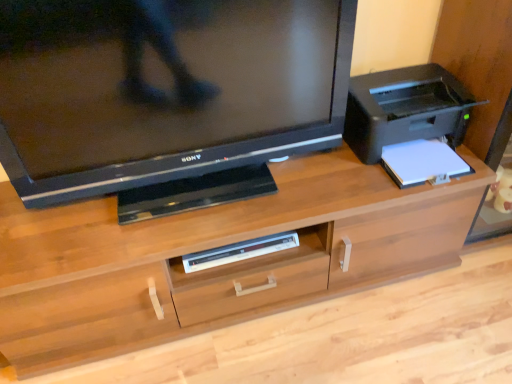
Question: Is wooden desk at center at the back of matte black television at upper left?

Choices:
 (A) yes
 (B) no

Answer: (B)

Question: From a real-world perspective, is matte black television at upper left positioned over wooden desk at center based on gravity?

Choices:
 (A) yes
 (B) no

Answer: (A)

Question: Does matte black television at upper left appear on the right side of wooden desk at center?

Choices:
 (A) yes
 (B) no

Answer: (B)

Question: Does matte black television at upper left have a smaller size compared to wooden desk at center?

Choices:
 (A) no
 (B) yes

Answer: (B)

Question: Does matte black television at upper left contain wooden desk at center?

Choices:
 (A) yes
 (B) no

Answer: (B)

Question: Is matte black television at upper left facing towards wooden desk at center?

Choices:
 (A) no
 (B) yes

Answer: (A)

Question: From the image's perspective, does wooden desk at center appear higher than white plastic dvd player at center?

Choices:
 (A) yes
 (B) no

Answer: (A)

Question: Would you say wooden desk at center is a long distance from white plastic dvd player at center?

Choices:
 (A) no
 (B) yes

Answer: (A)

Question: Does wooden desk at center have a larger size compared to white plastic dvd player at center?

Choices:
 (A) yes
 (B) no

Answer: (A)

Question: Is wooden desk at center located outside white plastic dvd player at center?

Choices:
 (A) yes
 (B) no

Answer: (A)

Question: Is wooden desk at center looking in the opposite direction of white plastic dvd player at center?

Choices:
 (A) yes
 (B) no

Answer: (A)

Question: Can you confirm if wooden desk at center is shorter than white plastic dvd player at center?

Choices:
 (A) no
 (B) yes

Answer: (A)

Question: Is wooden desk at center taller than matte black television at upper left?

Choices:
 (A) yes
 (B) no

Answer: (B)